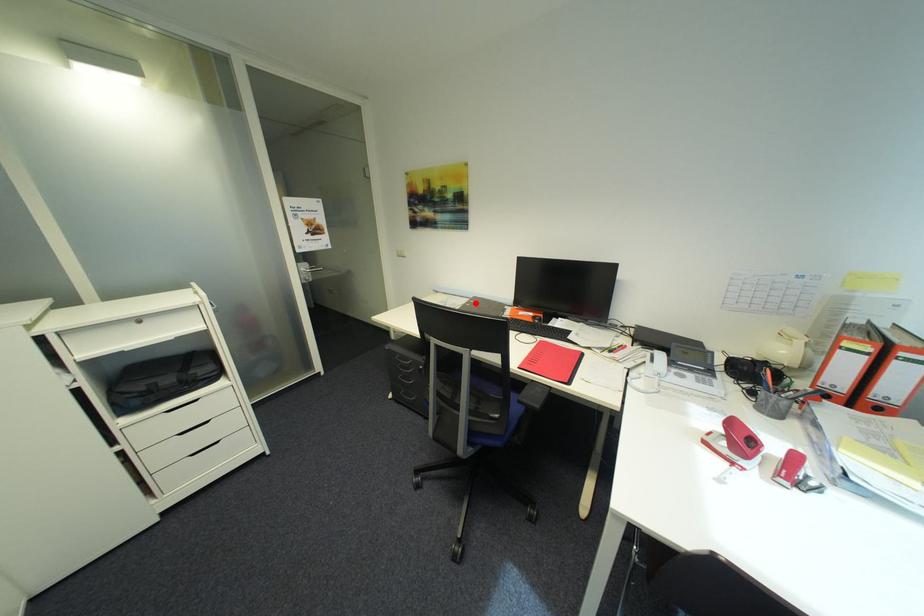
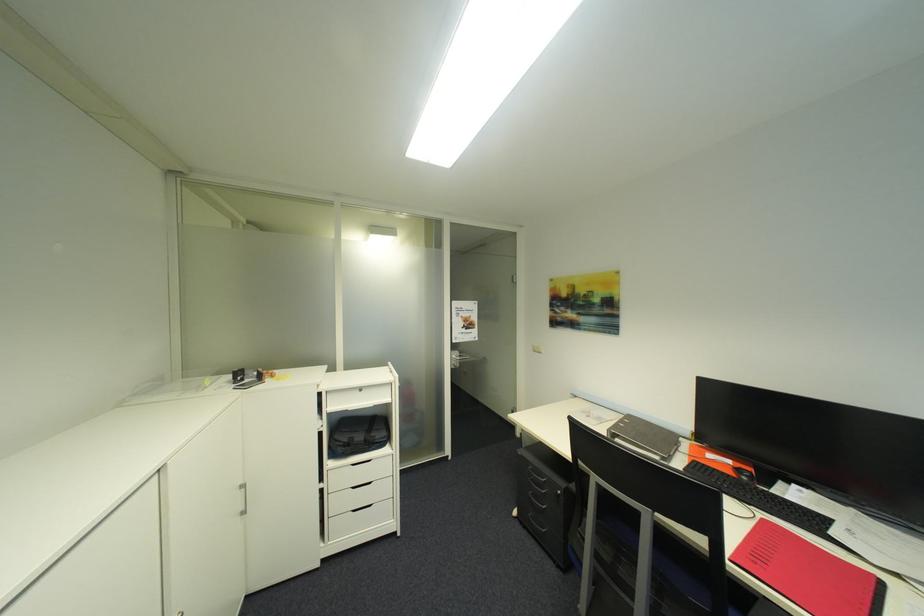
Find the pixel in the second image that matches the highlighted location in the first image.

(628, 422)